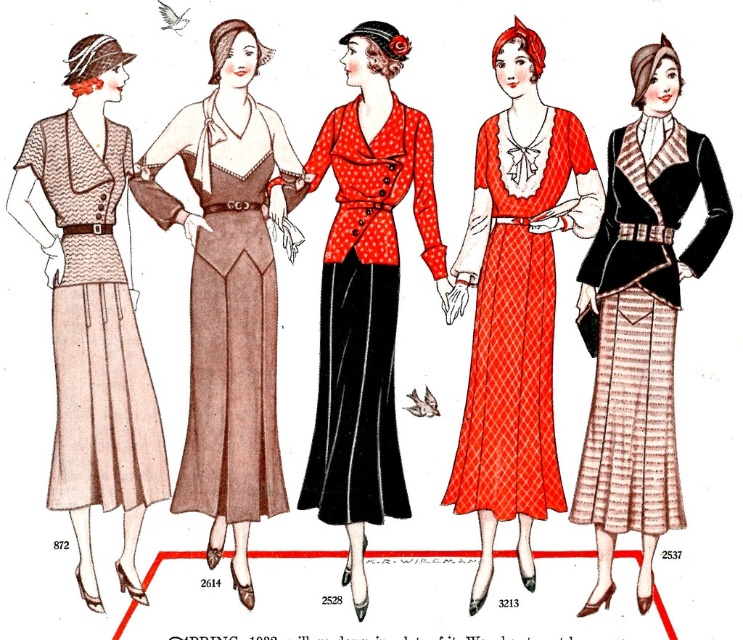
Is matte red dress at center above matte beige dress at left?

Indeed, matte red dress at center is positioned over matte beige dress at left.

Is matte red dress at center thinner than matte beige dress at left?

No, matte red dress at center is not thinner than matte beige dress at left.

Where is `matte red dress at center`? matte red dress at center is located at coordinates (515, 304).

Is matte red dress at center to the left of matte black vest at center from the viewer's perspective?

Correct, you'll find matte red dress at center to the left of matte black vest at center.

Is point (522, 90) positioned behind point (614, 518)?

Yes, it is behind point (614, 518).

The image size is (743, 640). I want to click on matte red dress at center, so click(x=515, y=304).

Is point (126, 433) farther from viewer compared to point (369, 102)?

That is False.

Does matte beige dress at left have a larger size compared to polka dot fabric dress at center?

Correct, matte beige dress at left is larger in size than polka dot fabric dress at center.

Between point (81, 118) and point (308, 189), which one is positioned in front?

Positioned in front is point (81, 118).

This screenshot has height=640, width=743. Identify the location of matte beige dress at left. (91, 314).